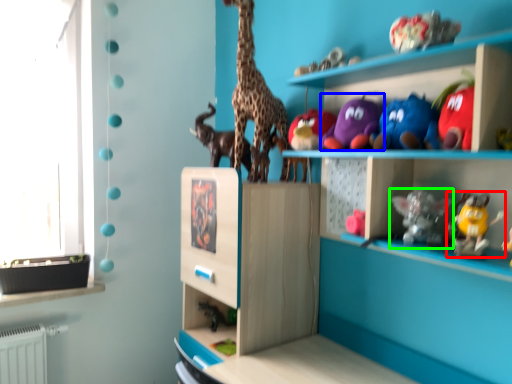
Question: Which object is the farthest from toy (highlighted by a red box)? Choose among these: toy (highlighted by a blue box) or toy (highlighted by a green box).

Choices:
 (A) toy
 (B) toy

Answer: (A)